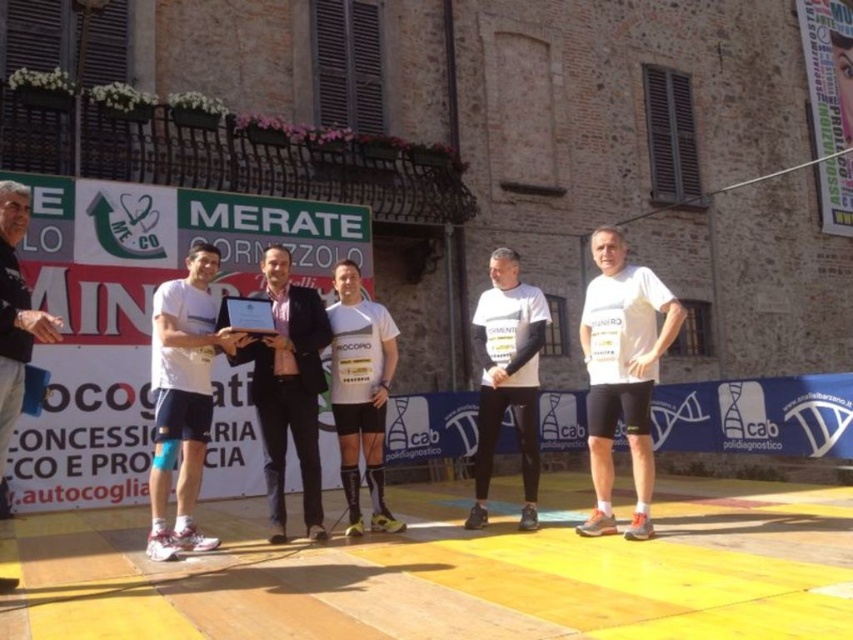
Does point (318, 374) come behind point (498, 272)?

That is False.

Which of these two, matte black suit at center or white matte shirt at center, stands taller?

With more height is matte black suit at center.

The width and height of the screenshot is (853, 640). In order to click on matte black suit at center in this screenshot , I will do `click(288, 388)`.

The width and height of the screenshot is (853, 640). I want to click on matte black suit at center, so click(288, 388).

What do you see at coordinates (622, 372) in the screenshot? The height and width of the screenshot is (640, 853). I see `white matte t-shirt at center` at bounding box center [622, 372].

Which is more to the right, white matte t-shirt at center or white matte shorts at center?

white matte t-shirt at center

Between point (660, 282) and point (183, 376), which one is positioned behind?

The point (660, 282) is behind.

Where is `white matte t-shirt at center`? The width and height of the screenshot is (853, 640). white matte t-shirt at center is located at coordinates (622, 372).

Does white matte t-shirt at center have a larger size compared to matte black suit at center?

Yes.

Describe the element at coordinates (622, 372) in the screenshot. I see `white matte t-shirt at center` at that location.

Between point (605, 444) and point (312, 365), which one is positioned in front?

Positioned in front is point (605, 444).

Identify the location of white matte t-shirt at center. (622, 372).